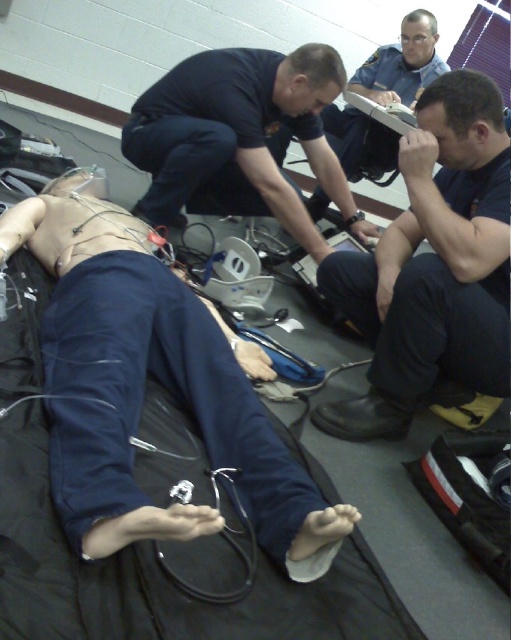
Who is higher up, blue fabric at lower left or dark blue uniform at center?

dark blue uniform at center is above.

Who is more distant from viewer, (x=306, y=541) or (x=225, y=129)?

Point (x=225, y=129)

Is point (71, 296) less distant than point (245, 145)?

Yes, it is in front of point (245, 145).

Find the location of `blue fabric at lower left`. blue fabric at lower left is located at coordinates (144, 387).

Which of these two, blue fabric at lower left or black matte uniform at center, stands shorter?

Standing shorter between the two is black matte uniform at center.

Is blue fabric at lower left wider than black matte uniform at center?

Indeed, blue fabric at lower left has a greater width compared to black matte uniform at center.

Who is more distant from viewer, (x=74, y=420) or (x=475, y=259)?

Point (x=475, y=259)

This screenshot has height=640, width=511. Find the location of `blue fabric at lower left`. blue fabric at lower left is located at coordinates (144, 387).

Can you confirm if black matte uniform at center is wider than dark blue uniform at center?

A: Incorrect, black matte uniform at center's width does not surpass dark blue uniform at center's.

Locate an element on the screen. black matte uniform at center is located at coordinates [x=432, y=268].

Where is `black matte uniform at center`? black matte uniform at center is located at coordinates (432, 268).